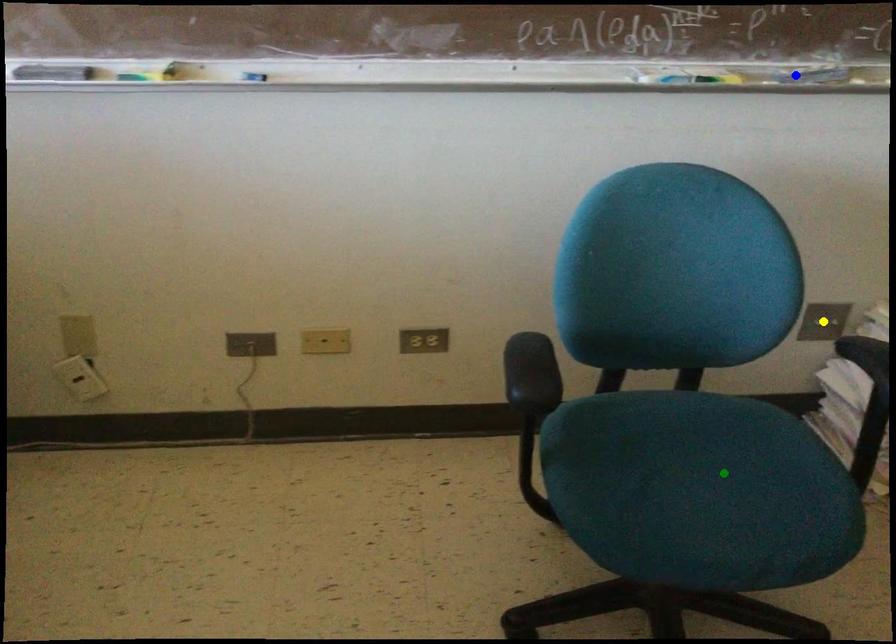
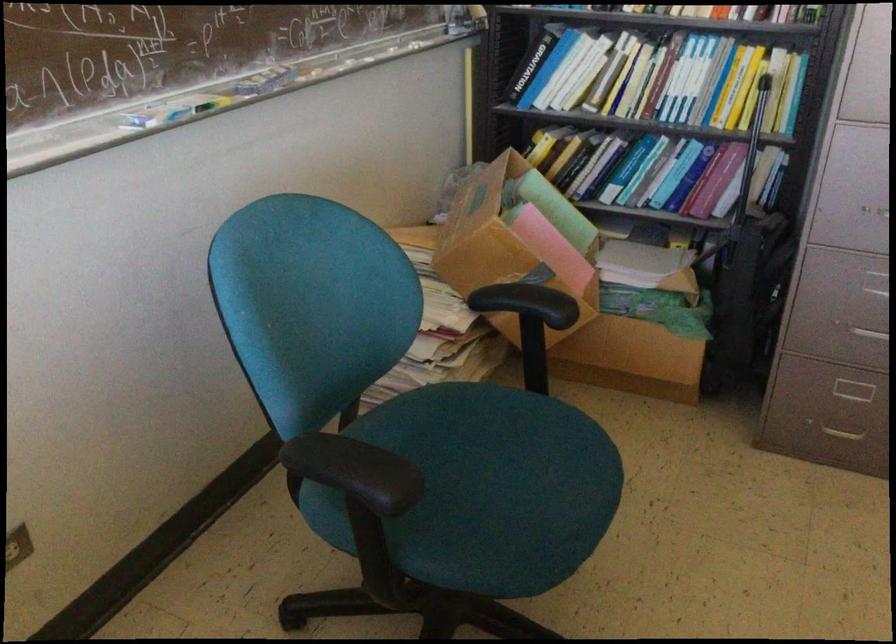
I am providing you with two images of the same scene from different viewpoints. Three points are marked in image1. Which point corresponds to a part or object that is occluded in image2?In image1, three points are marked. Which of them correspond to a part or object that is occluded in image2?Among the three points shown in image1, which one corresponds to a part or object that is no longer visible due to occlusion in image2?

Invisible in image2: yellow point.